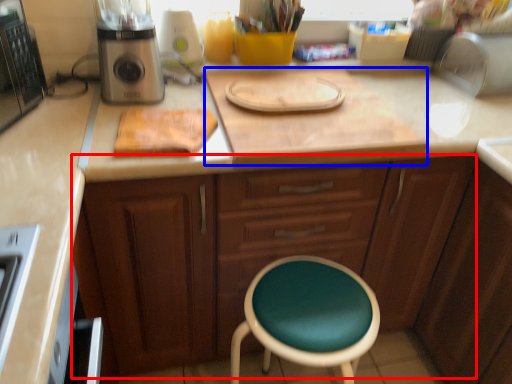
Question: Which object is further to the camera taking this photo, cabinetry (highlighted by a red box) or counter top (highlighted by a blue box)?

Choices:
 (A) cabinetry
 (B) counter top

Answer: (B)